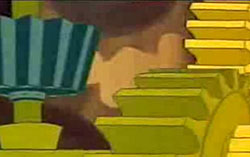
Identify the location of toy. (43, 51), (170, 85).